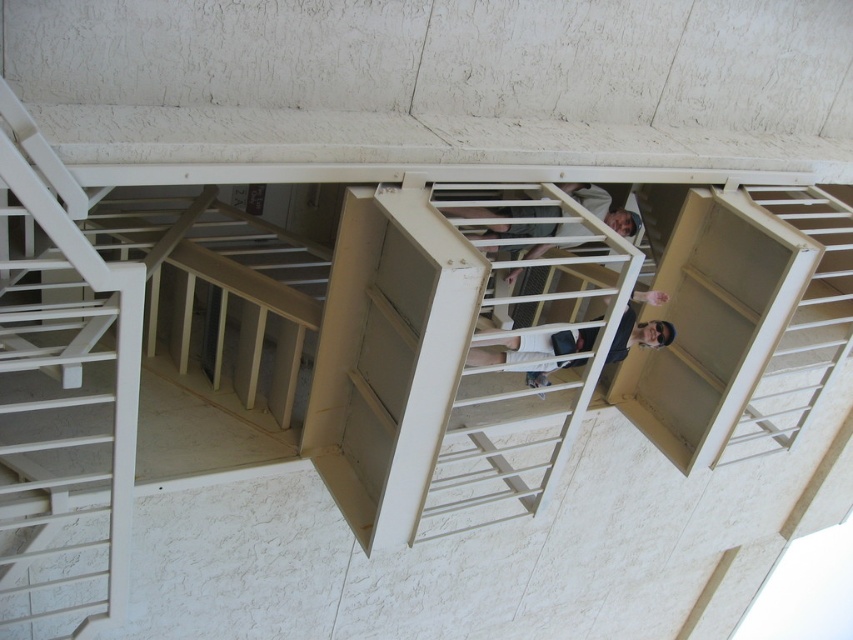
Question: Does white matte ladder at left appear under matte white shirt at upper center?

Choices:
 (A) no
 (B) yes

Answer: (B)

Question: Which object is the closest to the matte white shirt at upper center?

Choices:
 (A) white matte ladder at left
 (B) matte white shirt at center

Answer: (B)

Question: From the image, what is the correct spatial relationship of white matte ladder at left in relation to matte white shirt at center?

Choices:
 (A) right
 (B) left

Answer: (B)

Question: Which of the following is the closest to the observer?

Choices:
 (A) white matte ladder at left
 (B) matte white shirt at upper center

Answer: (A)

Question: Which object appears closest to the camera in this image?

Choices:
 (A) matte white shirt at center
 (B) white matte ladder at left
 (C) white matte stair at upper right

Answer: (B)

Question: Is white matte stair at upper right positioned in front of matte white shirt at upper center?

Choices:
 (A) yes
 (B) no

Answer: (B)